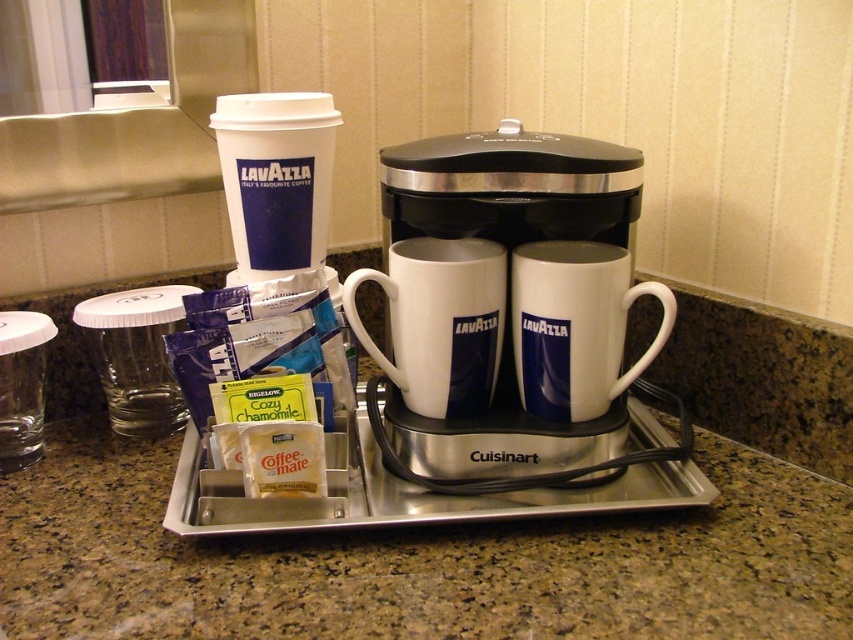
You are setting up a coffee station and need to place a new coffee cup to the right of the granite countertop at center. Where should you place it relative to the white ceramic mug at center?

The granite countertop at center is to the left of the white ceramic mug at center. Therefore, placing the new coffee cup to the right of the granite countertop at center would position it directly next to the white ceramic mug at center on its right side.

You are setting up a coffee station and want to place a decorative plate on the granite countertop at center so it doesn t slide off the white glossy mug at center. Considering their heights, will the plate stay stable?

The granite countertop at center is taller than the white glossy mug at center, so placing the decorative plate on the granite countertop at center will keep it stable as it is higher and provides a solid base.